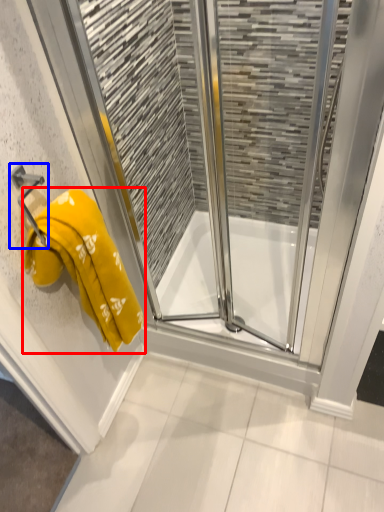
Question: Which point is closer to the camera, towel (highlighted by a red box) or towel bar (highlighted by a blue box)?

Choices:
 (A) towel
 (B) towel bar

Answer: (A)